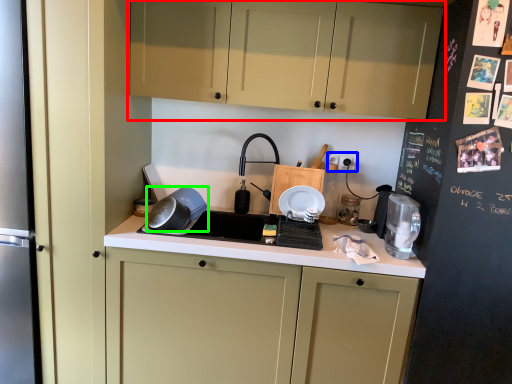
Question: Which object is positioned closest to cabinetry (highlighted by a red box)? Select from electric outlet (highlighted by a blue box) and kitchen appliance (highlighted by a green box).

Choices:
 (A) electric outlet
 (B) kitchen appliance

Answer: (A)